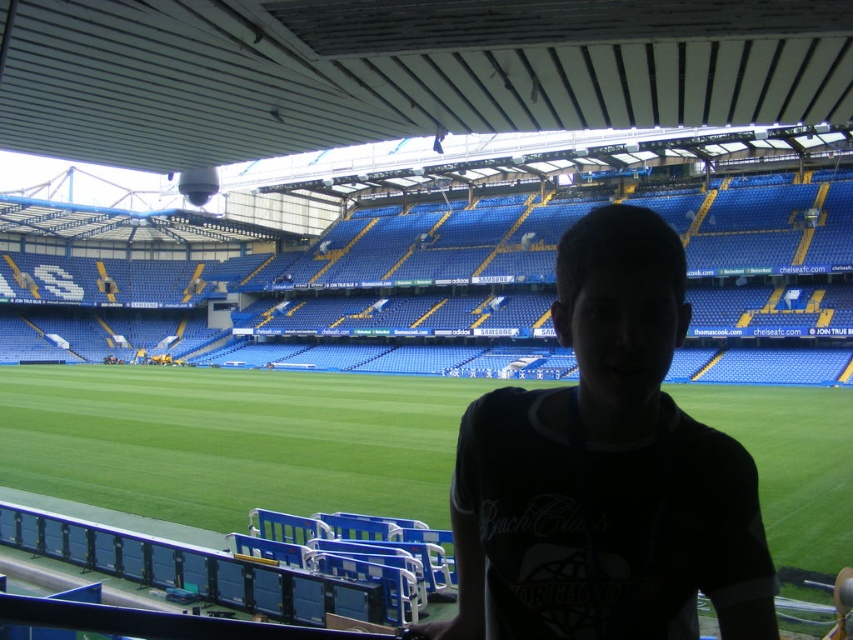
You are a photographer trying to capture a wide shot of the stadium. You notice the black matte shirt at center and the green grass at center in your frame. Which object should you focus on to ensure the other remains in the background?

You should focus on the black matte shirt at center because it is smaller than the green grass at center, meaning it is farther away and thus the green grass at center will stay in the background.

You are a photographer trying to capture a shot of the black matte shirt at center and the green grass at center from the front. Which object should you focus on first if you want to ensure both are in focus?

The black matte shirt at center has a greater height compared to green grass at center, so you should focus on the black matte shirt at center first to ensure both are in focus.